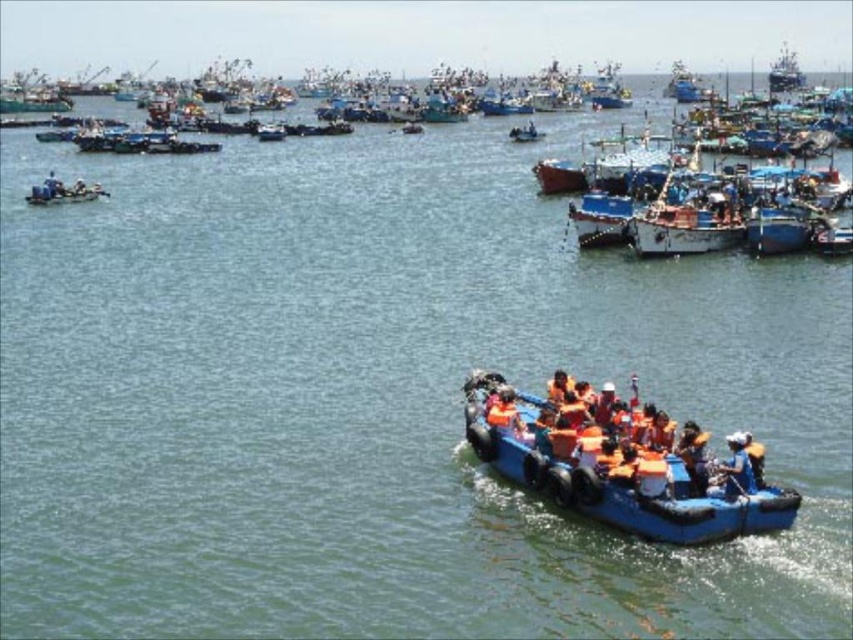
Does blue rubber boat at lower right have a lesser height compared to matte blue raft at left?

In fact, blue rubber boat at lower right may be taller than matte blue raft at left.

Does point (515, 392) come farther from viewer compared to point (45, 189)?

No, it is not.

The width and height of the screenshot is (853, 640). What are the coordinates of `blue rubber boat at lower right` in the screenshot? It's located at (608, 468).

Is the position of blue rubber boat at lower right less distant than that of orange life vest at center?

Yes, blue rubber boat at lower right is closer to the viewer.

Between point (590, 500) and point (741, 442), which one is positioned in front?

Point (590, 500)

What do you see at coordinates (608, 468) in the screenshot? The height and width of the screenshot is (640, 853). I see `blue rubber boat at lower right` at bounding box center [608, 468].

Locate an element on the screen. This screenshot has width=853, height=640. blue rubber boat at lower right is located at coordinates [608, 468].

Can you confirm if orange life vest at center is positioned below matte blue raft at left?

Indeed, orange life vest at center is positioned under matte blue raft at left.

Is orange life vest at center smaller than matte blue raft at left?

Yes.

This screenshot has width=853, height=640. Describe the element at coordinates (735, 467) in the screenshot. I see `orange life vest at center` at that location.

You are a GUI agent. You are given a task and a screenshot of the screen. Output one action in this format:
    pyautogui.click(x=<x>, y=<y>)
    Task: Click on the orange life vest at center
    The height and width of the screenshot is (640, 853).
    Given the screenshot: What is the action you would take?
    pyautogui.click(x=735, y=467)